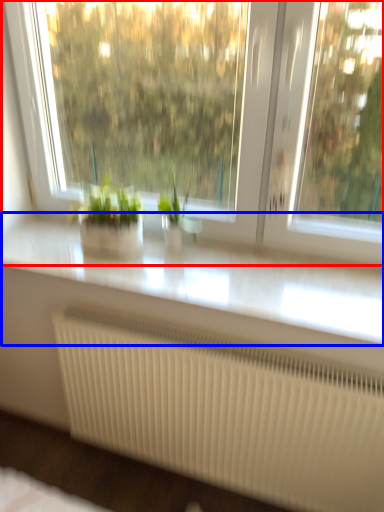
Question: Which object is closer to the camera taking this photo, window (highlighted by a red box) or counter top (highlighted by a blue box)?

Choices:
 (A) window
 (B) counter top

Answer: (A)